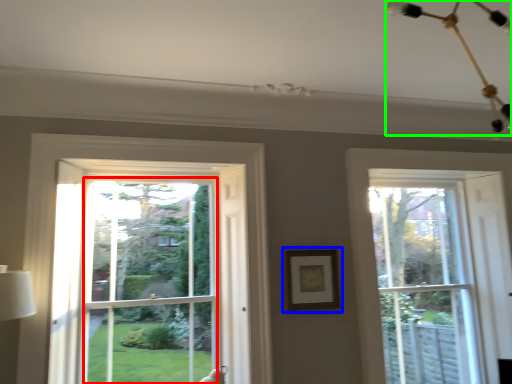
Question: Which object is positioned farthest from window screen (highlighted by a red box)? Select from picture frame (highlighted by a blue box) and light fixture (highlighted by a green box).

Choices:
 (A) picture frame
 (B) light fixture

Answer: (B)